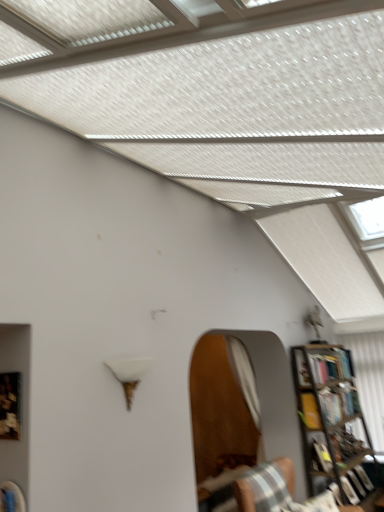
Question: Considering the relative positions of striped fabric chair at lower right and metallic bookcase at right in the image provided, is striped fabric chair at lower right to the right of metallic bookcase at right from the viewer's perspective?

Choices:
 (A) yes
 (B) no

Answer: (B)

Question: Considering the relative sizes of striped fabric chair at lower right and metallic bookcase at right in the image provided, is striped fabric chair at lower right shorter than metallic bookcase at right?

Choices:
 (A) no
 (B) yes

Answer: (B)

Question: Can you confirm if striped fabric chair at lower right is wider than metallic bookcase at right?

Choices:
 (A) no
 (B) yes

Answer: (B)

Question: Can you confirm if striped fabric chair at lower right is thinner than metallic bookcase at right?

Choices:
 (A) no
 (B) yes

Answer: (A)

Question: Considering the relative sizes of striped fabric chair at lower right and metallic bookcase at right in the image provided, is striped fabric chair at lower right taller than metallic bookcase at right?

Choices:
 (A) no
 (B) yes

Answer: (A)

Question: In the image, is metallic bookcase at right on the left side or the right side of striped fabric chair at lower right?

Choices:
 (A) left
 (B) right

Answer: (B)

Question: In terms of height, does metallic bookcase at right look taller or shorter compared to striped fabric chair at lower right?

Choices:
 (A) tall
 (B) short

Answer: (A)

Question: Is point (314, 488) positioned closer to the camera than point (281, 492)?

Choices:
 (A) closer
 (B) farther

Answer: (B)

Question: Is metallic bookcase at right bigger or smaller than striped fabric chair at lower right?

Choices:
 (A) small
 (B) big

Answer: (B)

Question: In terms of size, does hardcover book at right appear bigger or smaller than white fabric curtain at right?

Choices:
 (A) big
 (B) small

Answer: (B)

Question: Is point (326, 394) positioned closer to the camera than point (382, 336)?

Choices:
 (A) farther
 (B) closer

Answer: (B)

Question: Considering the positions of hardcover book at right and white fabric curtain at right in the image, is hardcover book at right taller or shorter than white fabric curtain at right?

Choices:
 (A) short
 (B) tall

Answer: (A)

Question: From the image's perspective, is hardcover book at right above or below white fabric curtain at right?

Choices:
 (A) below
 (B) above

Answer: (B)

Question: Is white fabric curtain at right taller or shorter than hardcover book at right?

Choices:
 (A) short
 (B) tall

Answer: (B)

Question: Based on their sizes in the image, would you say white fabric curtain at right is bigger or smaller than hardcover book at right?

Choices:
 (A) small
 (B) big

Answer: (B)